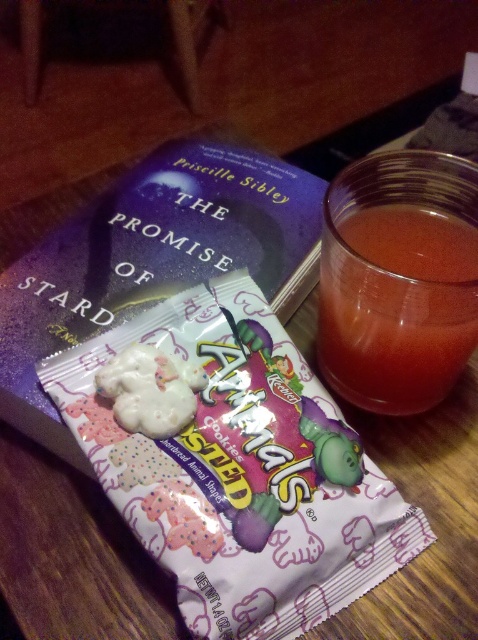
Question: Which point is closer to the camera?

Choices:
 (A) (240, 253)
 (B) (149, 400)
 (C) (324, 323)
 (D) (125, 497)

Answer: (D)

Question: Can you confirm if translucent glass at upper right is positioned below white frosted cookie at center?

Choices:
 (A) no
 (B) yes

Answer: (A)

Question: Which object is the closest to the translucent glass at upper right?

Choices:
 (A) white frosted animal cookies at center
 (B) purple matte hardcover book at center

Answer: (A)

Question: Which object is positioned farthest from the translucent glass at upper right?

Choices:
 (A) white frosted cookie at center
 (B) white frosted animal cookies at center

Answer: (A)

Question: Does purple matte hardcover book at center have a lesser width compared to white frosted cookie at center?

Choices:
 (A) yes
 (B) no

Answer: (B)

Question: Can you confirm if purple matte hardcover book at center is wider than translucent glass at upper right?

Choices:
 (A) no
 (B) yes

Answer: (B)